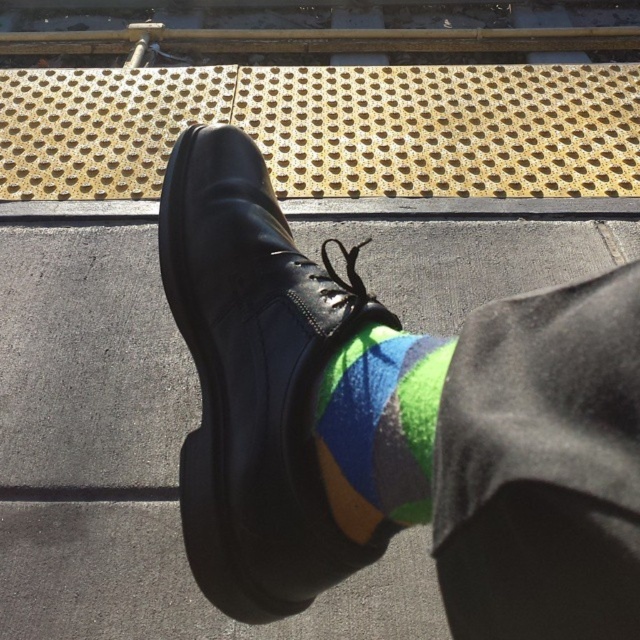
You are standing in front of the black leather shoe at center and the multicolored felt sock at center. Which object is positioned more to the right?

The multicolored felt sock at center is positioned more to the right than the black leather shoe at center.

You are trying to determine the spatial relationship between the black leather shoe at center and the multicolored felt sock at center. Based on the scene, which object is positioned higher?

The black leather shoe at center is positioned higher than the multicolored felt sock at center.

You are trying to determine if the black leather shoe at center can fit into a storage box designed for the multicolored felt sock at center. Based on their widths, will the shoe fit?

The black leather shoe at center might be wider than the multicolored felt sock at center, so it may not fit into the storage box designed for the sock.